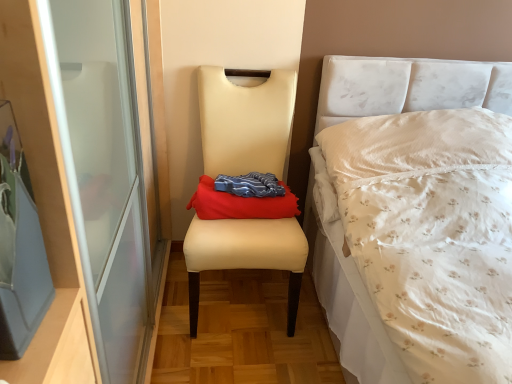
I want to click on free space in front of beige leather chair at center, so click(x=240, y=357).